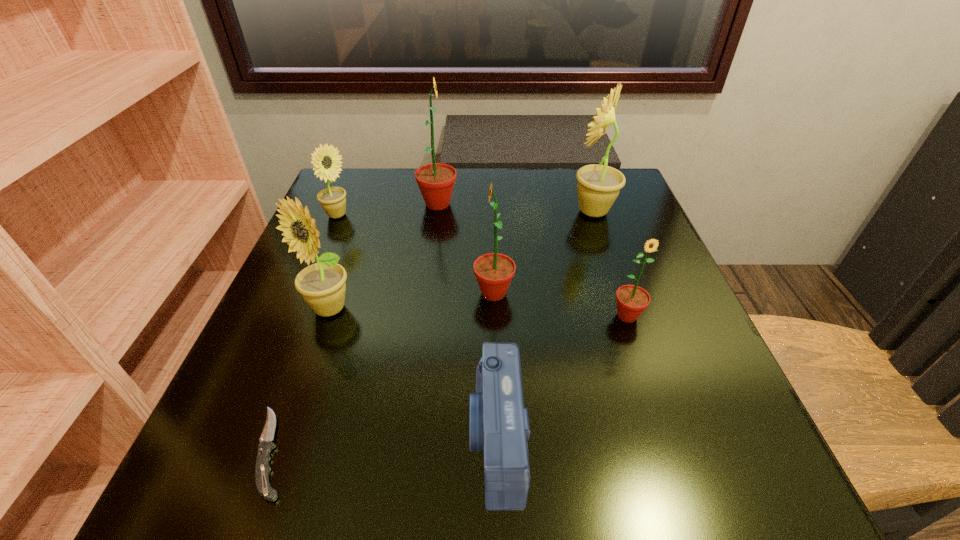
At what (x,y) coordinates should I click in order to perform the action: click on green sunflower that is the closest one to the rightmost green sunflower. Please return your answer as a coordinate pair (x, y). The image size is (960, 540). Looking at the image, I should click on (494, 272).

Where is `vacant region that satisfies the following two spatial constraints: 1. on the face of the rightmost green sunflower; 2. on the lens of the second shortest object`? vacant region that satisfies the following two spatial constraints: 1. on the face of the rightmost green sunflower; 2. on the lens of the second shortest object is located at coordinates (668, 439).